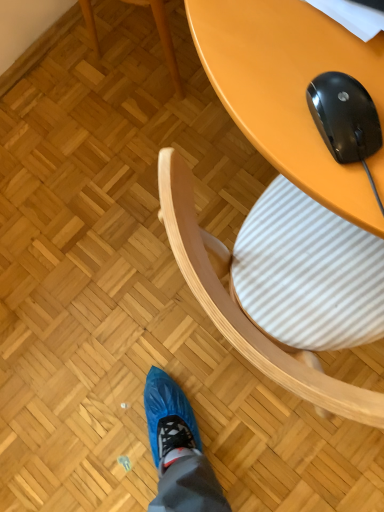
Question: Is point (367, 138) closer or farther from the camera than point (168, 66)?

Choices:
 (A) farther
 (B) closer

Answer: (B)

Question: From a real-world perspective, is black glossy mouse at upper right above or below wooden chair at upper center?

Choices:
 (A) below
 (B) above

Answer: (B)

Question: Relative to wooden chair at upper center, is black glossy mouse at upper right in front or behind?

Choices:
 (A) front
 (B) behind

Answer: (A)

Question: Based on their sizes in the image, would you say wooden chair at upper center is bigger or smaller than black glossy mouse at upper right?

Choices:
 (A) small
 (B) big

Answer: (B)

Question: Based on their positions, is wooden chair at upper center located to the left or right of black glossy mouse at upper right?

Choices:
 (A) right
 (B) left

Answer: (B)

Question: Does point (82, 6) appear closer or farther from the camera than point (332, 97)?

Choices:
 (A) closer
 (B) farther

Answer: (B)

Question: From a real-world perspective, is wooden chair at upper center positioned above or below black glossy mouse at upper right?

Choices:
 (A) above
 (B) below

Answer: (B)